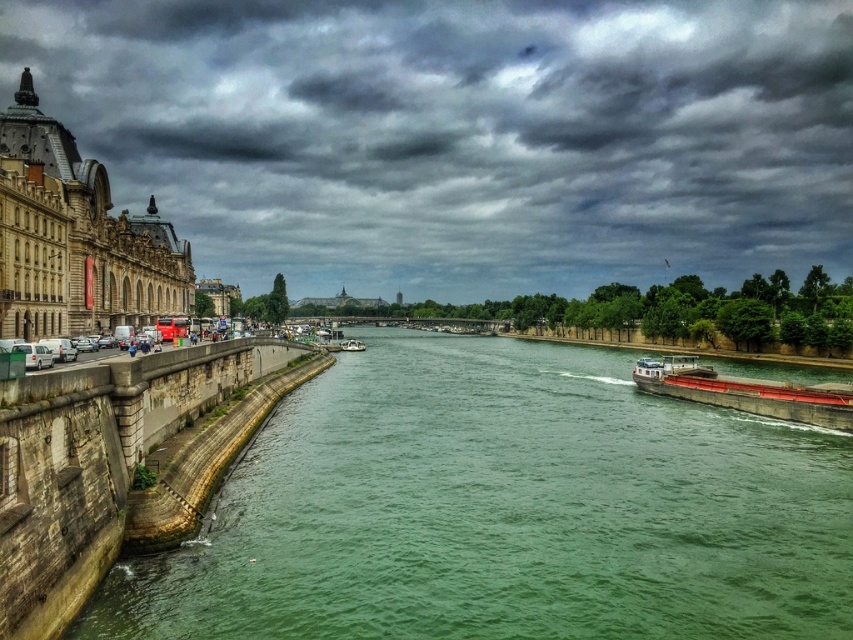
Question: Is dark gray clouds at upper center above green stone river at center?

Choices:
 (A) no
 (B) yes

Answer: (B)

Question: Which point is farther to the camera?

Choices:
 (A) (691, 381)
 (B) (300, 109)

Answer: (B)

Question: Does green stone river at center appear under white plastic boat at center?

Choices:
 (A) yes
 (B) no

Answer: (A)

Question: Which of the following is the closest to the observer?

Choices:
 (A) red matte barge at right
 (B) dark gray clouds at upper center

Answer: (A)

Question: Which point is closer to the camera taking this photo?

Choices:
 (A) (511, 157)
 (B) (344, 340)
 (C) (718, 403)

Answer: (C)

Question: Is green stone river at center positioned at the back of white plastic boat at center?

Choices:
 (A) no
 (B) yes

Answer: (A)